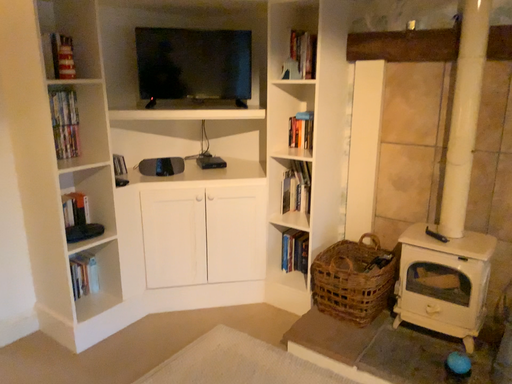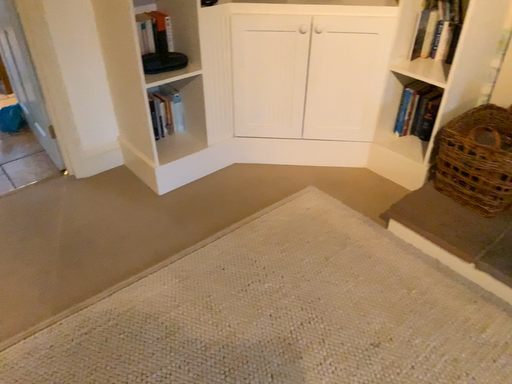
Question: How did the camera likely rotate when shooting the video?

Choices:
 (A) rotated upward
 (B) rotated downward

Answer: (B)